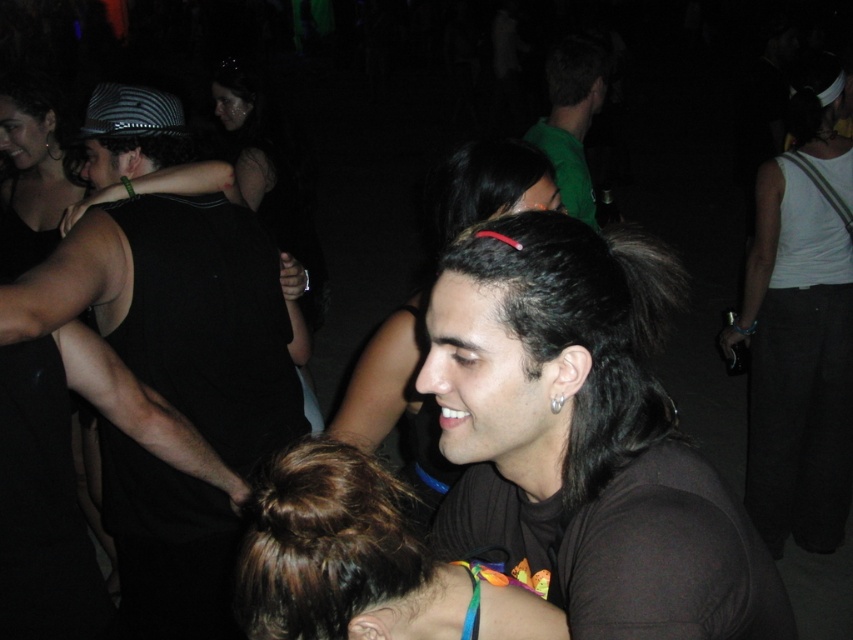
Question: Is dark brown hair at center closer to the viewer compared to brown hair at center?

Choices:
 (A) yes
 (B) no

Answer: (B)

Question: Estimate the real-world distances between objects in this image. Which object is closer to the brown hair at center?

Choices:
 (A) dark brown hair at center
 (B) black matte hair at center

Answer: (A)

Question: Which point appears closest to the camera in this image?

Choices:
 (A) (618, 248)
 (B) (117, 236)
 (C) (576, 109)

Answer: (A)

Question: Which point is farther to the camera?

Choices:
 (A) black matte hair at center
 (B) green matte shirt at upper center
 (C) black shiny hair at center

Answer: (B)

Question: Is the position of black shiny hair at center more distant than that of matte black tank top at left?

Choices:
 (A) yes
 (B) no

Answer: (B)

Question: Does brown hair at center have a lesser width compared to green matte shirt at upper center?

Choices:
 (A) no
 (B) yes

Answer: (B)